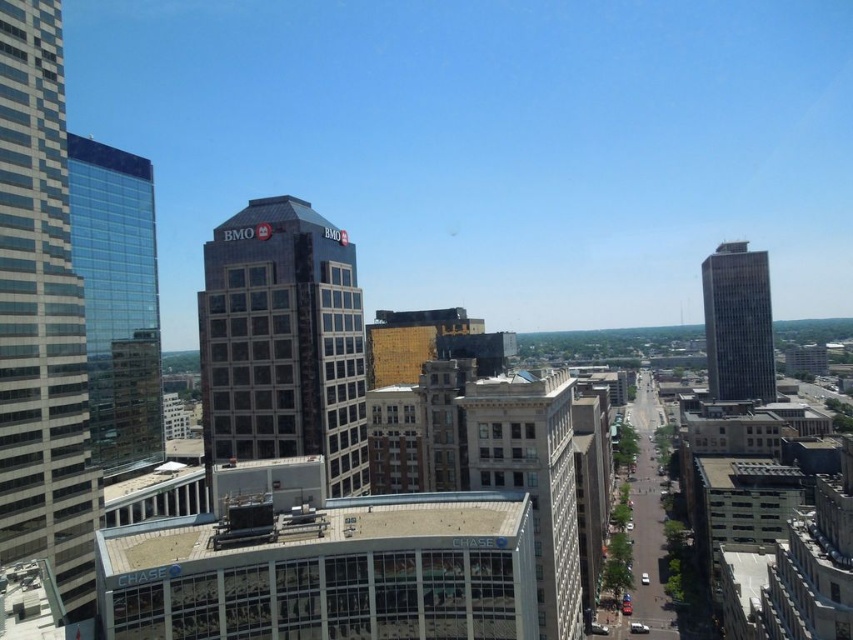
Question: Can you confirm if transparent glass skyscraper at left is positioned to the right of gray stone building at center?

Choices:
 (A) no
 (B) yes

Answer: (A)

Question: Which of these objects is positioned farthest from the gray glass skyscraper at right?

Choices:
 (A) dark gray glass building at center
 (B) glassy reflective skyscraper at left
 (C) gray stone building at center

Answer: (B)

Question: Which point is closer to the camera?

Choices:
 (A) (737, 250)
 (B) (125, 164)
 (C) (558, 392)

Answer: (C)

Question: Is dark gray glass building at center below transparent glass skyscraper at left?

Choices:
 (A) yes
 (B) no

Answer: (A)

Question: Which point is closer to the camera?

Choices:
 (A) transparent glass skyscraper at left
 (B) gray glass skyscraper at right
 (C) dark gray glass building at center

Answer: (C)

Question: From the image, what is the correct spatial relationship of glassy reflective skyscraper at left in relation to dark gray glass building at center?

Choices:
 (A) below
 (B) above

Answer: (B)